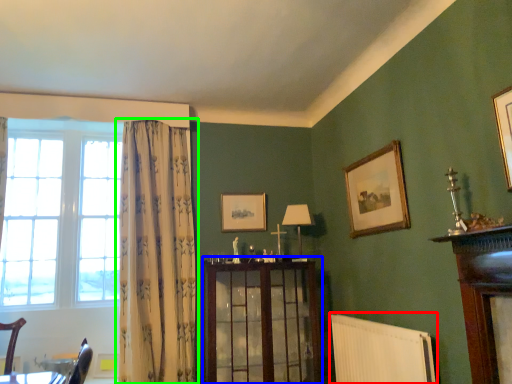
Question: Considering the real-world distances, which object is closest to radiator (highlighted by a red box)? dresser (highlighted by a blue box) or curtain (highlighted by a green box).

Choices:
 (A) dresser
 (B) curtain

Answer: (A)